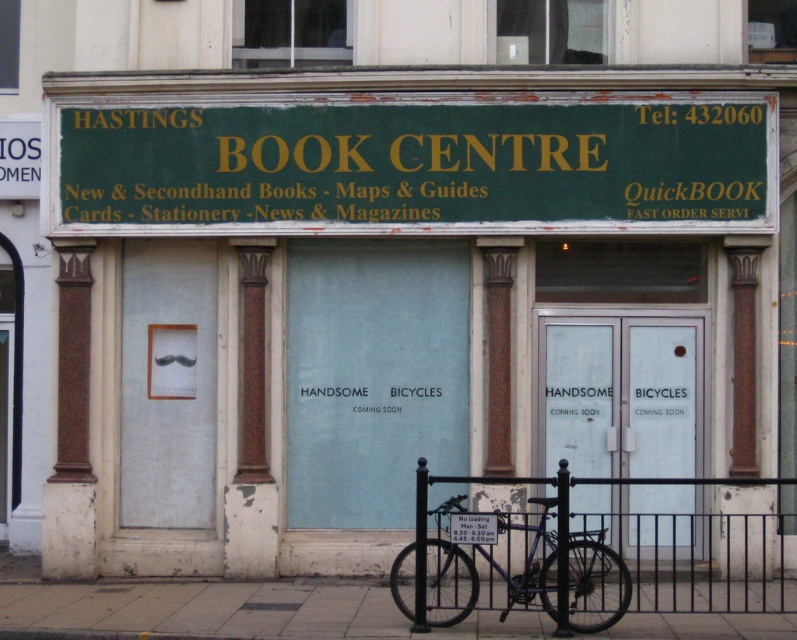
Does concrete sidewalk at lower center come in front of shiny blue bicycle at center?

No.

Can you confirm if concrete sidewalk at lower center is shorter than shiny blue bicycle at center?

Yes, concrete sidewalk at lower center is shorter than shiny blue bicycle at center.

This screenshot has height=640, width=797. What do you see at coordinates (234, 611) in the screenshot?
I see `concrete sidewalk at lower center` at bounding box center [234, 611].

Locate an element on the screen. The width and height of the screenshot is (797, 640). concrete sidewalk at lower center is located at coordinates (234, 611).

Between point (281, 196) and point (385, 614), which one is positioned in front?

Positioned in front is point (385, 614).

Who is more distant from viewer, (144, 195) or (764, 612)?

The point (144, 195) is behind.

Does point (438, 124) lie in front of point (89, 612)?

No.

Locate an element on the screen. The width and height of the screenshot is (797, 640). green painted wood signboard at upper center is located at coordinates (423, 164).

Image resolution: width=797 pixels, height=640 pixels. What do you see at coordinates (423, 164) in the screenshot? I see `green painted wood signboard at upper center` at bounding box center [423, 164].

Who is positioned more to the left, green painted wood signboard at upper center or shiny blue bicycle at center?

green painted wood signboard at upper center is more to the left.

Find the location of a particular element. green painted wood signboard at upper center is located at coordinates (423, 164).

Find the location of a particular element. green painted wood signboard at upper center is located at coordinates (x=423, y=164).